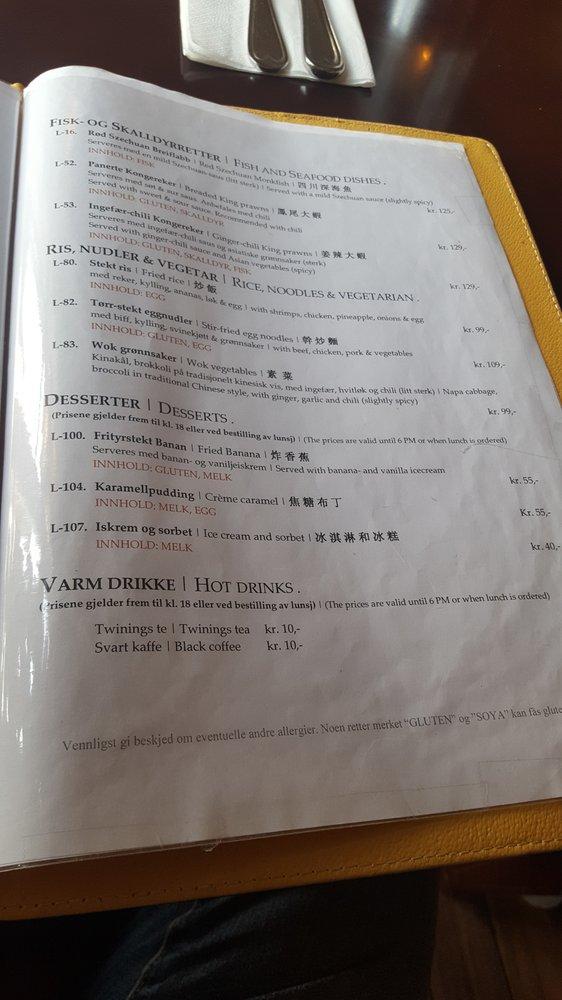
I want to click on napkin, so click(x=221, y=48).